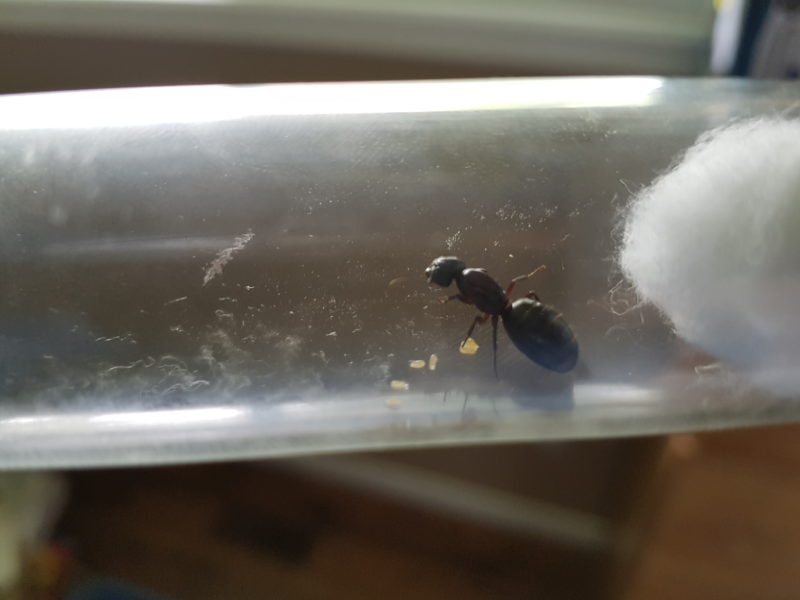
Where is `crumb`? The image size is (800, 600). crumb is located at coordinates (473, 346).